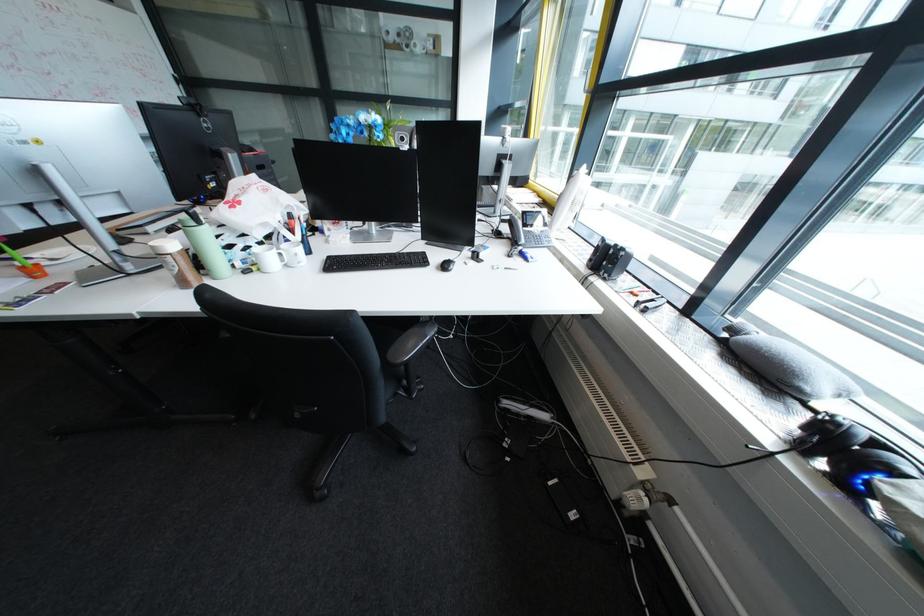
The location [446,265] corresponds to which object?

It corresponds to the black computer mouse in the image.